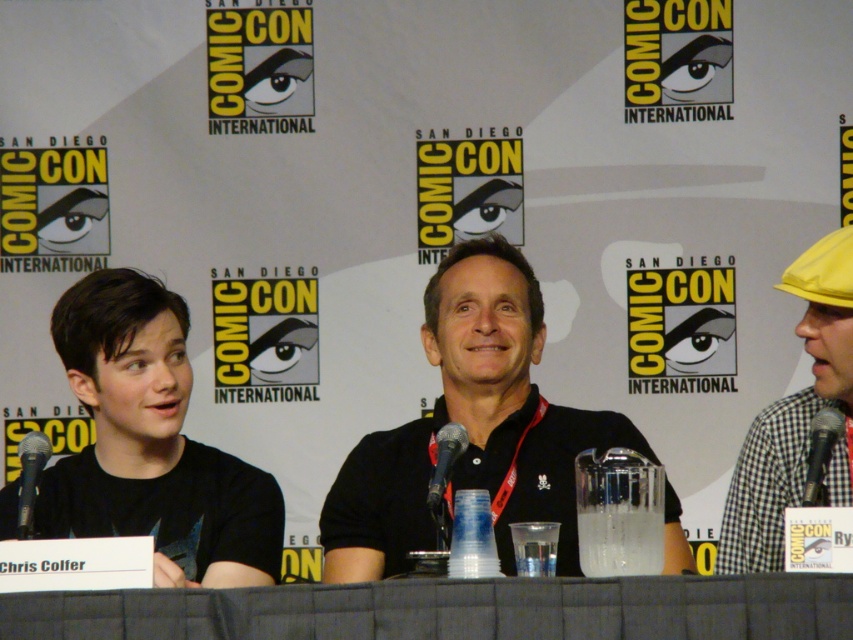
Question: Is yellow fabric hat at right above black metallic microphone at right?

Choices:
 (A) no
 (B) yes

Answer: (B)

Question: Which point is farther from the camera taking this photo?

Choices:
 (A) (453, 429)
 (B) (809, 436)

Answer: (B)

Question: Is black metallic microphone at right smaller than black metallic microphone at center?

Choices:
 (A) no
 (B) yes

Answer: (A)

Question: Which point is farther from the camera taking this photo?

Choices:
 (A) (822, 496)
 (B) (144, 476)
 (C) (688, 557)
 (D) (32, 516)

Answer: (B)

Question: Is gray fabric table at center bigger than black metallic microphone at center?

Choices:
 (A) yes
 (B) no

Answer: (A)

Question: Among these points, which one is farthest from the camera?

Choices:
 (A) (376, 515)
 (B) (824, 454)
 (C) (62, 360)
 (D) (77, 632)

Answer: (A)